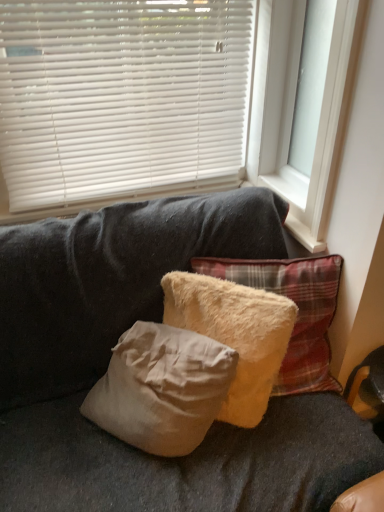
Question: Choose the correct answer: Is white plastic window frame at upper right inside fuzzy beige pillow at center, which is the 1th pillow from right to left, or outside it?

Choices:
 (A) inside
 (B) outside

Answer: (B)

Question: From a real-world perspective, relative to fuzzy beige pillow at center, the second pillow in the left-to-right sequence, is white plastic window frame at upper right vertically above or below?

Choices:
 (A) below
 (B) above

Answer: (B)

Question: Which is nearer to the fuzzy beige pillow at center, the second pillow in the left-to-right sequence?

Choices:
 (A) white plastic blinds at upper center
 (B) white plastic window frame at upper right
 (C) beige fluffy pillow at center, which ranks as the first pillow in left-to-right order

Answer: (C)

Question: Estimate the real-world distances between objects in this image. Which object is farther from the beige fluffy pillow at center, positioned as the second pillow in right-to-left order?

Choices:
 (A) white plastic window frame at upper right
 (B) fuzzy beige pillow at center, the second pillow in the left-to-right sequence
 (C) white plastic blinds at upper center

Answer: (C)